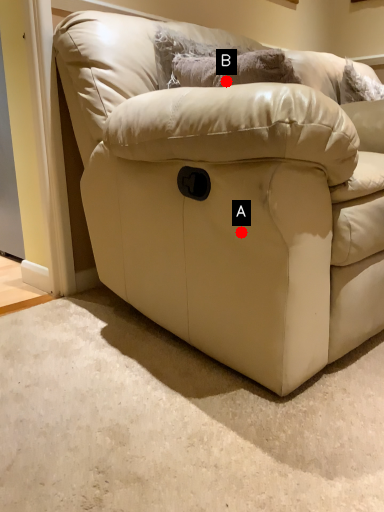
Question: Two points are circled on the image, labeled by A and B beside each circle. Which point is farther to the camera?

Choices:
 (A) A is further
 (B) B is further

Answer: (B)